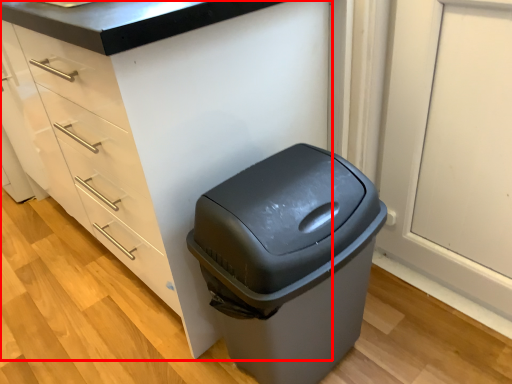
Question: In this image, where is cabinetry (annotated by the red box) located relative to waste container?

Choices:
 (A) left
 (B) right

Answer: (A)